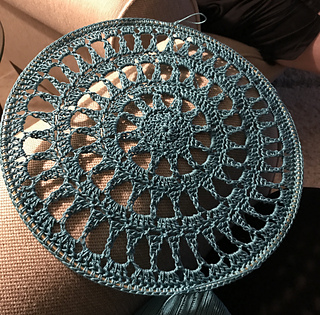
The image size is (320, 315). I want to click on floor, so click(5, 80), click(298, 109).